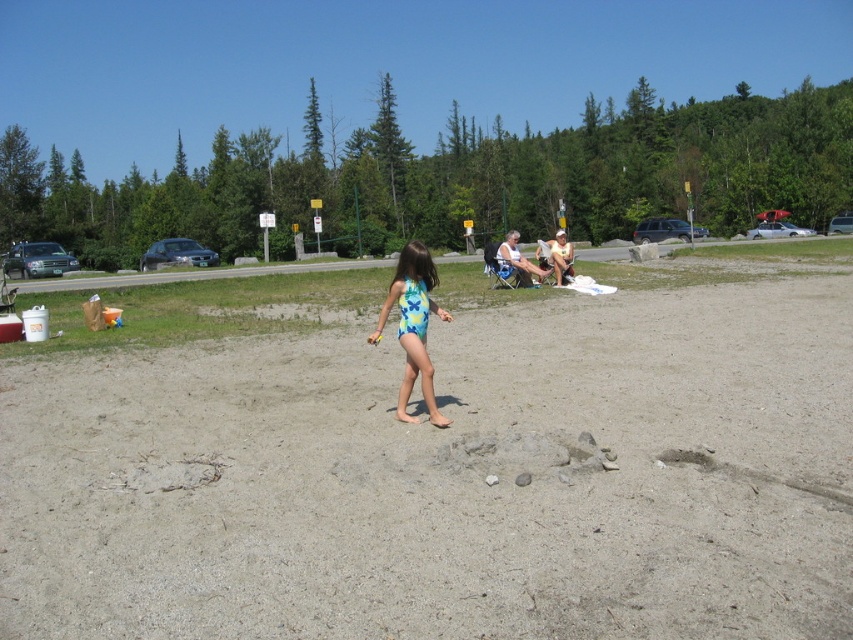
Is blue printed swimsuit at center positioned at the back of light brown wooden chair at center?

No, it is in front of light brown wooden chair at center.

Can you confirm if blue printed swimsuit at center is taller than light brown wooden chair at center?

Correct, blue printed swimsuit at center is much taller as light brown wooden chair at center.

Locate an element on the screen. blue printed swimsuit at center is located at coordinates (413, 324).

The image size is (853, 640). I want to click on blue printed swimsuit at center, so click(x=413, y=324).

Measure the distance between point (425,385) and camera.

Point (425,385) and camera are 22.26 feet apart.

The image size is (853, 640). Describe the element at coordinates (413, 324) in the screenshot. I see `blue printed swimsuit at center` at that location.

This screenshot has height=640, width=853. In order to click on blue printed swimsuit at center in this screenshot , I will do click(413, 324).

Is point (780, 298) farther from viewer compared to point (561, 248)?

That is False.

Is gray sand at center closer to the viewer compared to light brown wooden chair at center?

Yes.

Measure the distance between point (x=778, y=381) and camera.

Point (x=778, y=381) is 7.92 meters away from camera.

I want to click on gray sand at center, so (447, 477).